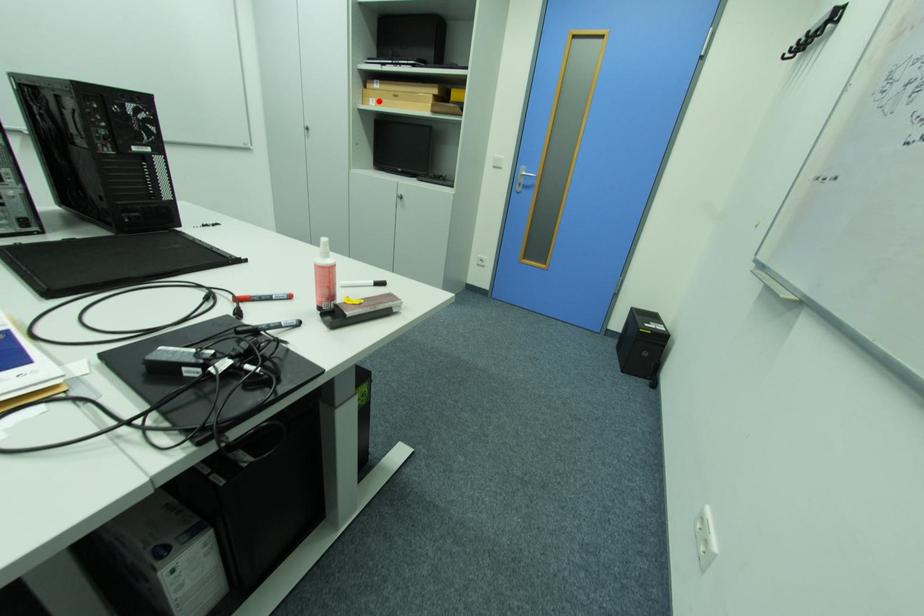
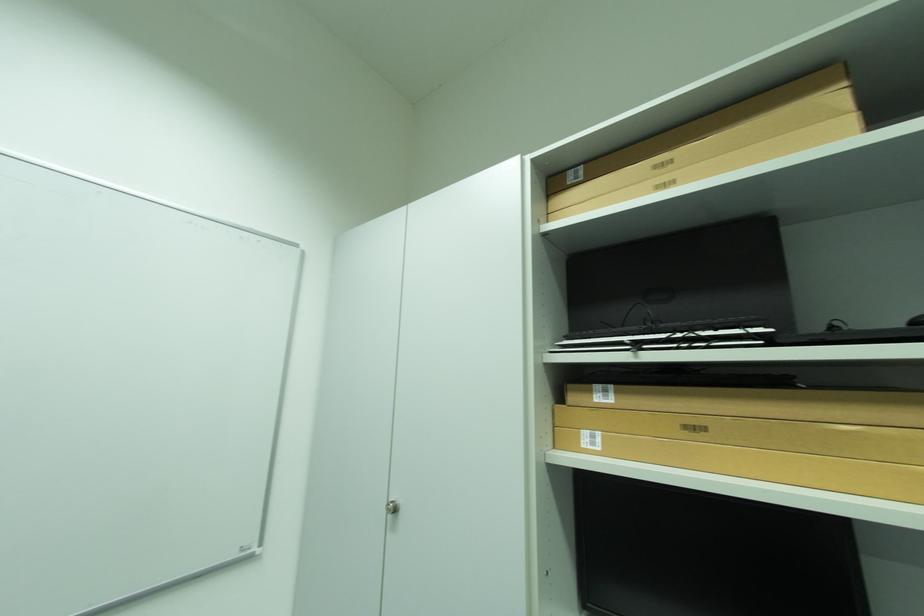
Question: I am providing you with two images of the same scene from different viewpoints. Image1 has a red point marked. In image2, the corresponding 3D location appears at what relative position? Reply with the corresponding letter.

Choices:
 (A) Closer
 (B) Farther

Answer: (B)